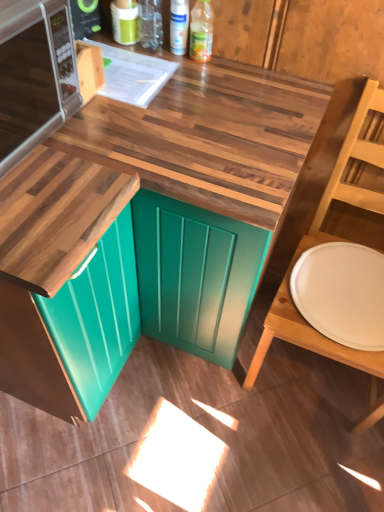
This screenshot has width=384, height=512. Identify the location of vacant region above white matte plate at right (from a real-world perspective). (343, 282).